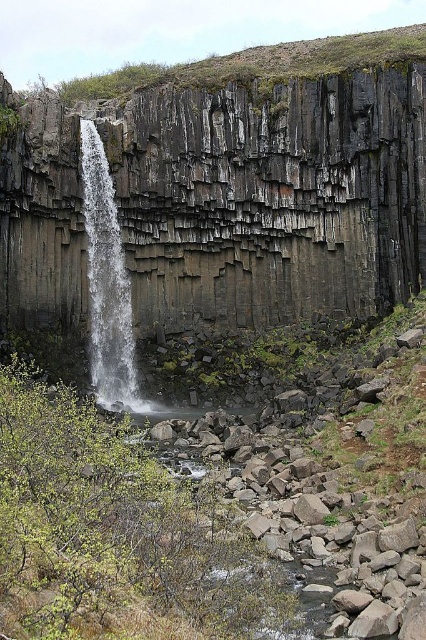
Can you confirm if dark gray basalt at center is thinner than white textured waterfall at left?

No.

Is point (71, 282) behind point (123, 262)?

No, it is not.

Image resolution: width=426 pixels, height=640 pixels. What do you see at coordinates (275, 182) in the screenshot?
I see `dark gray basalt at center` at bounding box center [275, 182].

The width and height of the screenshot is (426, 640). Identify the location of dark gray basalt at center. coord(275,182).

Does dark gray basalt at center appear over gray rocky creek at lower center?

Correct, dark gray basalt at center is located above gray rocky creek at lower center.

Is point (8, 262) closer to viewer compared to point (298, 564)?

No, it is not.

Locate an element on the screen. The image size is (426, 640). dark gray basalt at center is located at coordinates (275, 182).

Is point (126, 291) positioned before point (141, 428)?

No, (126, 291) is behind (141, 428).

Can you confirm if white textured waterfall at left is positioned to the left of gray rocky creek at lower center?

→ Yes, white textured waterfall at left is to the left of gray rocky creek at lower center.

What do you see at coordinates (106, 282) in the screenshot? I see `white textured waterfall at left` at bounding box center [106, 282].

This screenshot has height=640, width=426. I want to click on white textured waterfall at left, so click(x=106, y=282).